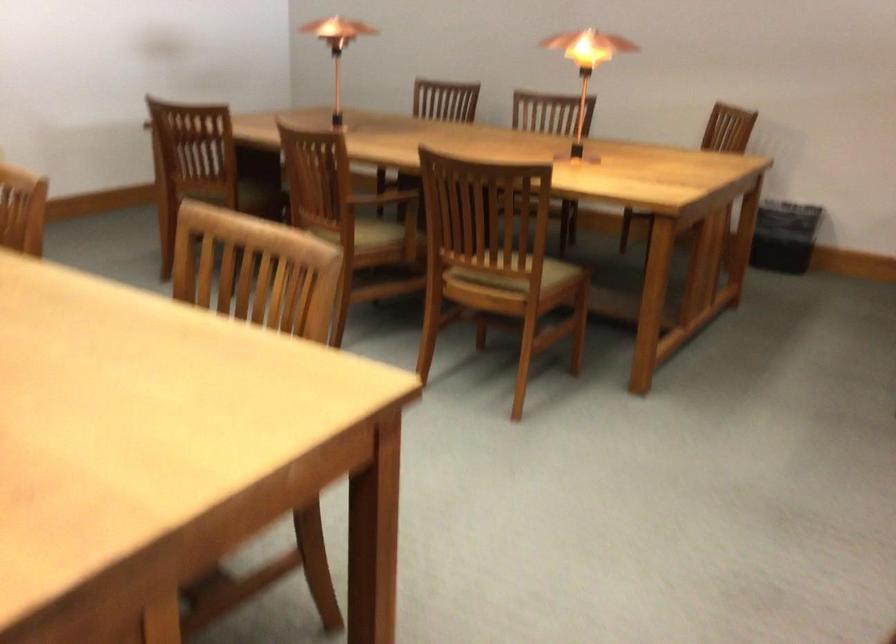
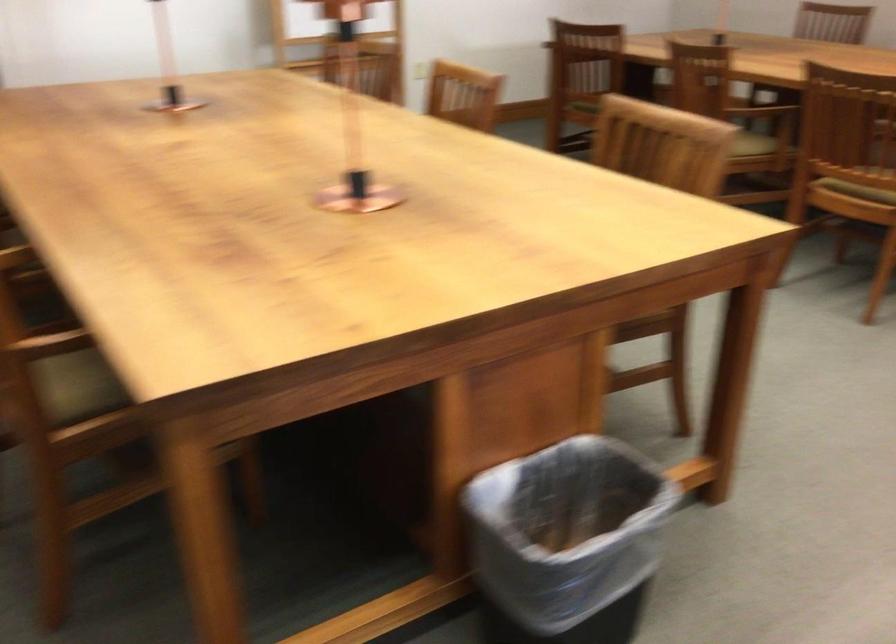
Find the pixel in the second image that matches pixel 381 247 in the first image.

(753, 144)